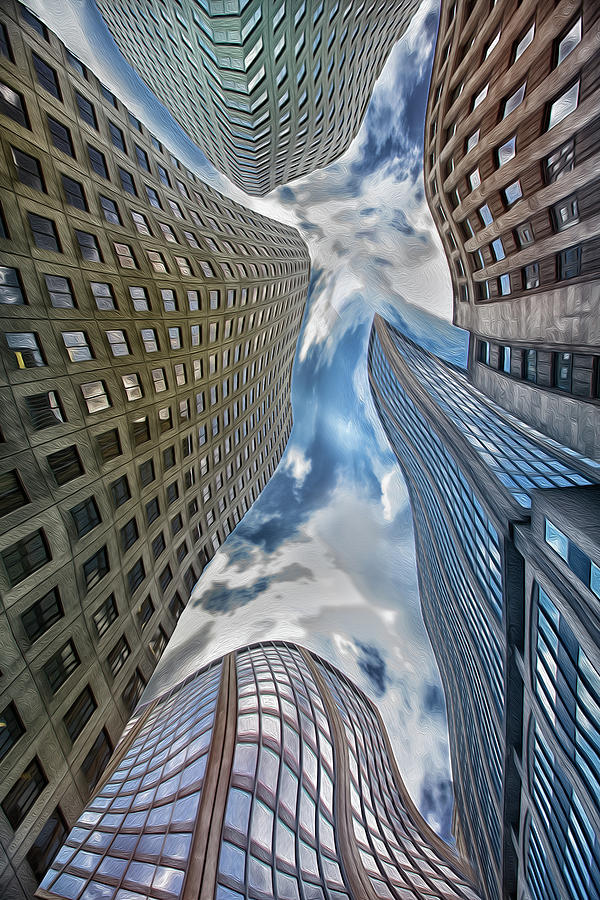
At what (x,y) coordinates should I click in order to perform the action: click on window with yellow item in it. Please return your answer as a coordinate pair (x, y). This screenshot has width=600, height=900. Looking at the image, I should click on (25, 357).